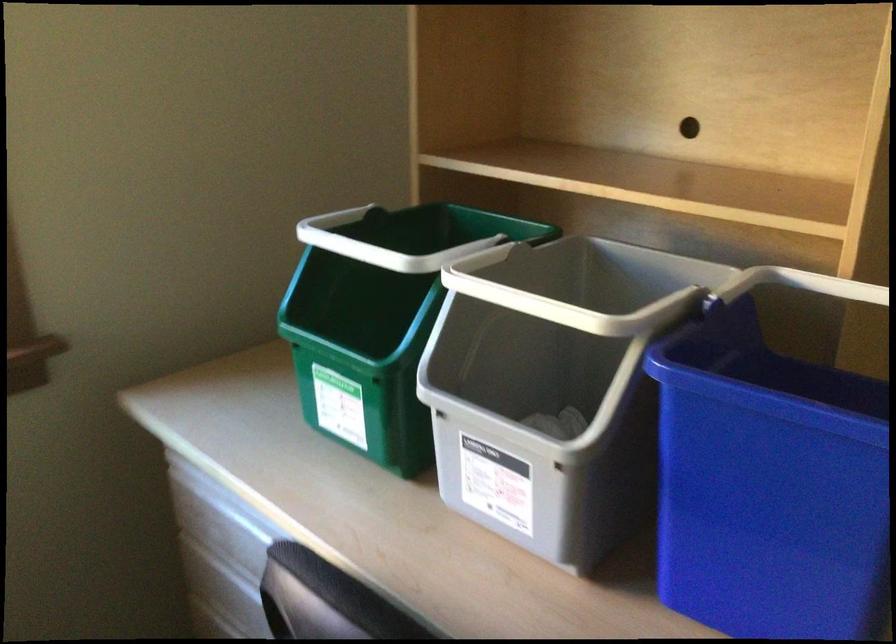
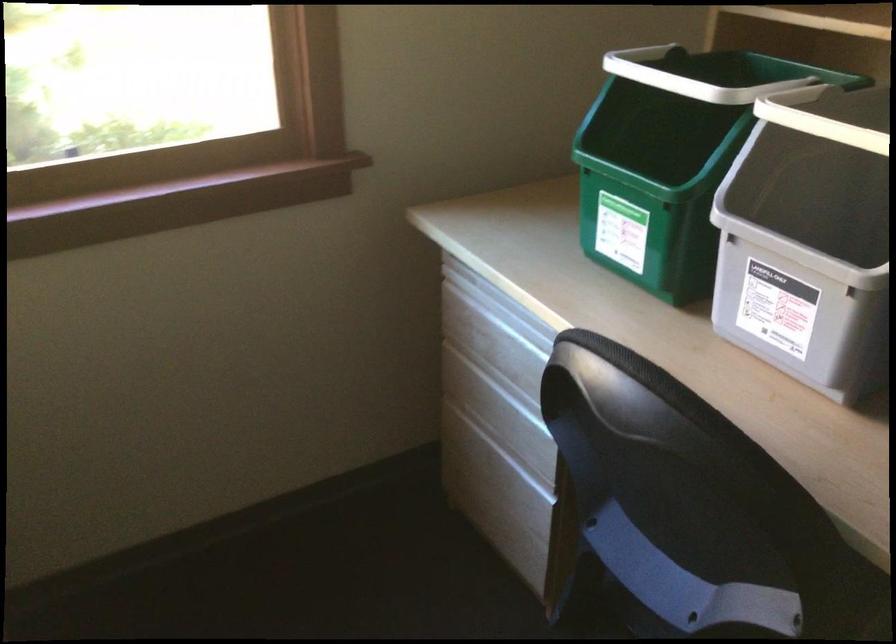
Locate, in the second image, the point that corresponds to the point at 365,374 in the first image.

(652, 194)